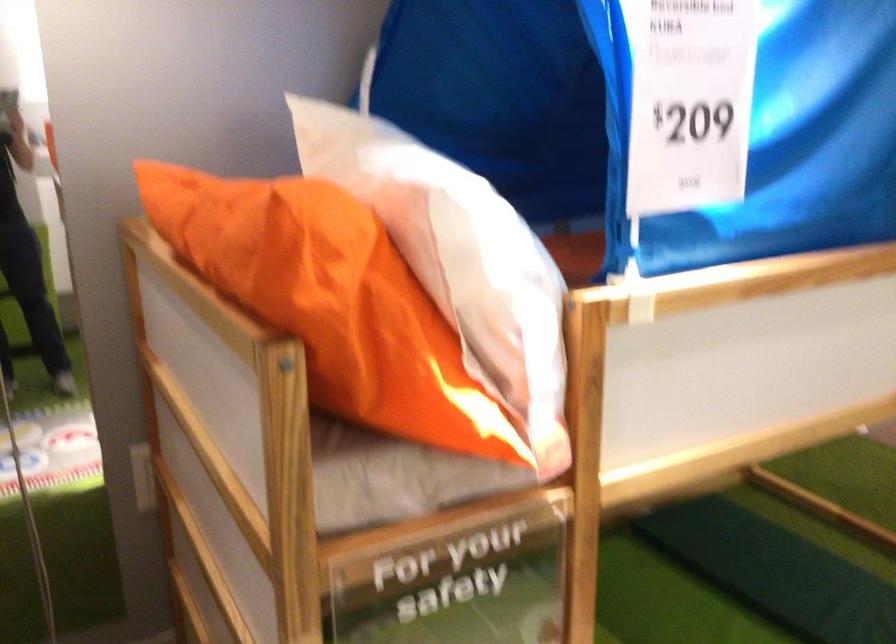
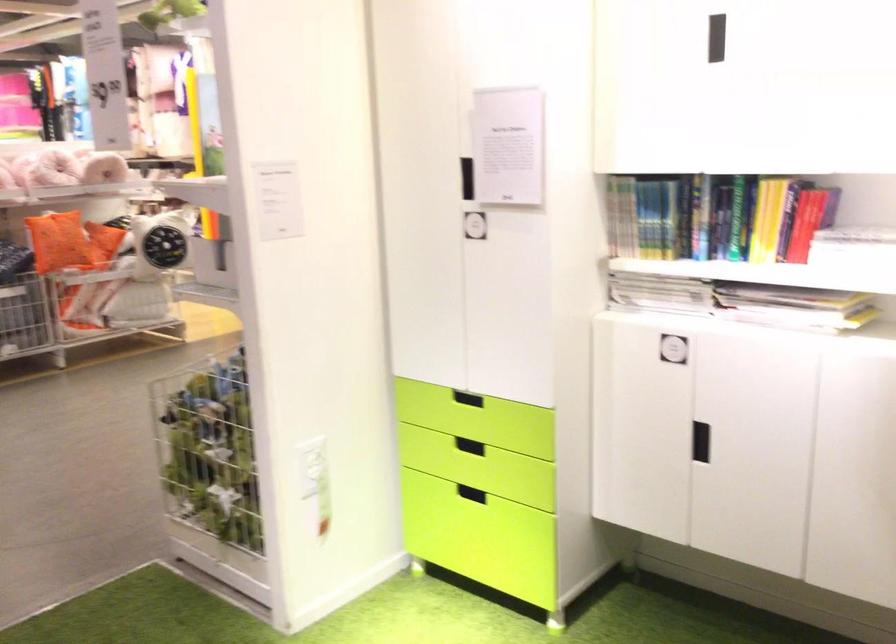
Question: How did the camera likely rotate?

Choices:
 (A) Left
 (B) Right
 (C) Up
 (D) Down

Answer: (B)